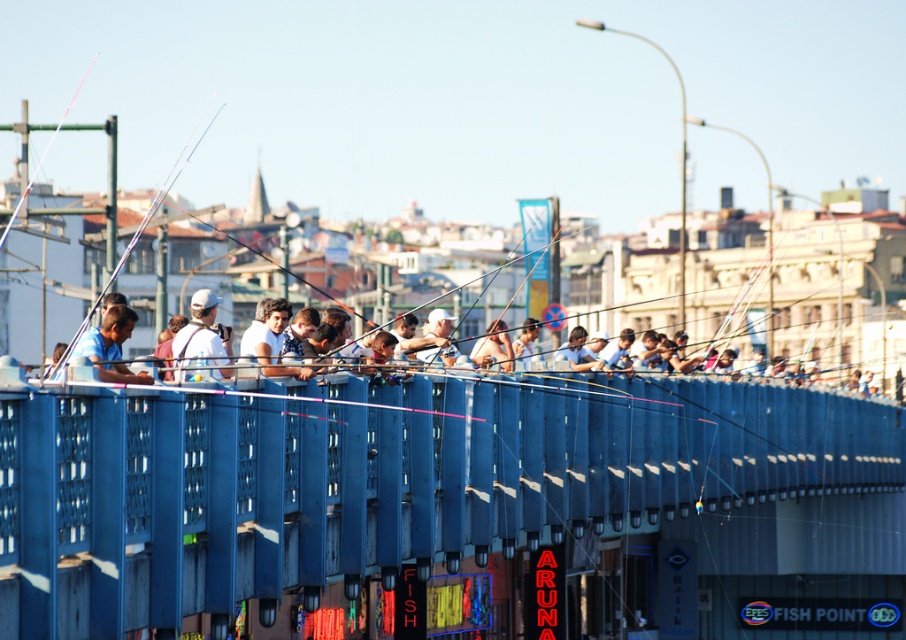
Is white matte cap at center below light brown skin at center?

No, white matte cap at center is not below light brown skin at center.

Which is below, white matte cap at center or light brown skin at center?

Positioned lower is light brown skin at center.

Is point (199, 362) behind point (505, 362)?

No, it is in front of (505, 362).

At what (x,y) coordinates should I click in order to perform the action: click on white matte cap at center. Please return your answer as a coordinate pair (x, y). The width and height of the screenshot is (906, 640). Looking at the image, I should click on (201, 340).

From the picture: How much distance is there between blue matte shirt at center and matte black fishing pole at upper left?

They are 102.24 meters apart.

Is blue matte shirt at center wider than matte black fishing pole at upper left?

No.

Is point (121, 371) in front of point (12, 220)?

Yes, point (121, 371) is closer to viewer.

Locate an element on the screen. Image resolution: width=906 pixels, height=640 pixels. blue matte shirt at center is located at coordinates (111, 346).

Can you confirm if blue metal fence at center is smaller than metallic fishing pole at left?

Yes.

Does blue metal fence at center have a greater width compared to metallic fishing pole at left?

No, blue metal fence at center is not wider than metallic fishing pole at left.

The image size is (906, 640). Find the location of `blue metal fence at center`. blue metal fence at center is located at coordinates (451, 502).